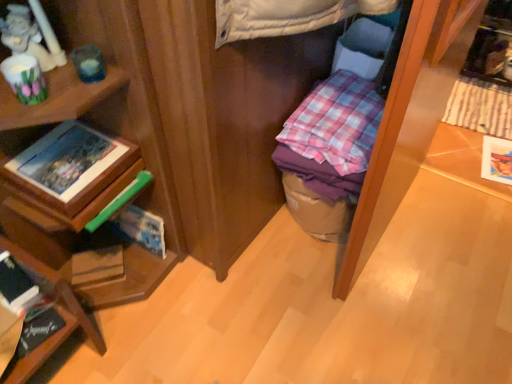
I want to click on free spot above wooden photo frame at left, acting as the third book starting from the bottom (from a real-world perspective), so [x=64, y=148].